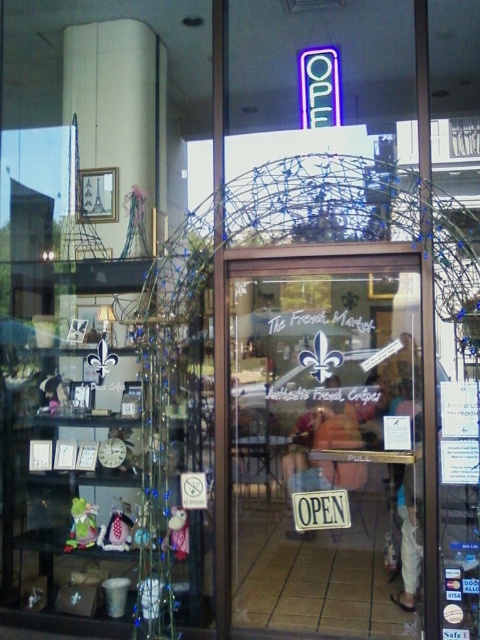
Does transparent glass door at center come in front of matte plastic bag at center?

Yes, transparent glass door at center is closer to the viewer.

Does point (385, 397) come closer to viewer compared to point (291, 476)?

That is True.

This screenshot has width=480, height=640. In order to click on transparent glass door at center in this screenshot , I will do `click(325, 442)`.